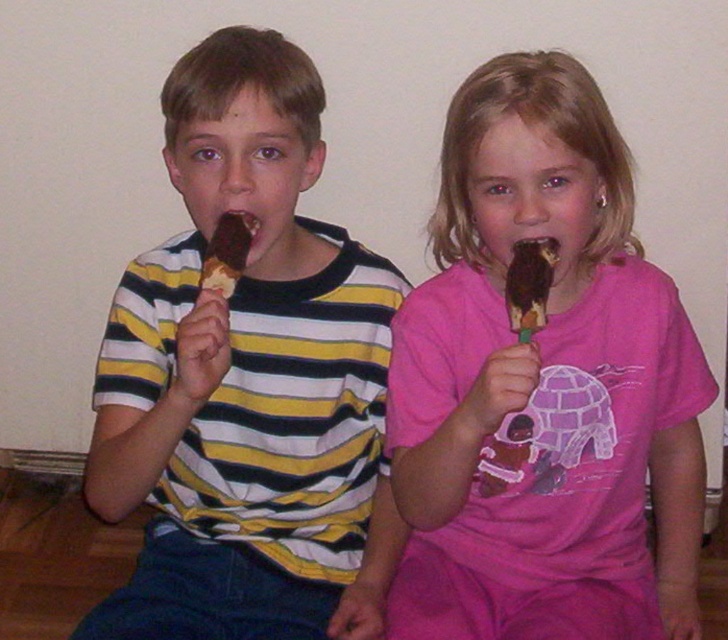
Question: From the image, what is the correct spatial relationship of pink matte ice cream at center in relation to chocolate coated ice cream at upper center?

Choices:
 (A) right
 (B) left

Answer: (A)

Question: Which point is closer to the camera taking this photo?

Choices:
 (A) (711, 401)
 (B) (514, 307)
 (C) (250, 218)

Answer: (B)

Question: Is pink matte ice cream at center wider than chocolate coated ice cream at upper center?

Choices:
 (A) no
 (B) yes

Answer: (B)

Question: Can you confirm if pink matte ice cream at center is positioned above chocolate ice cream at center?

Choices:
 (A) no
 (B) yes

Answer: (A)

Question: Which object is farther from the camera taking this photo?

Choices:
 (A) matte chocolate ice cream bar at center
 (B) chocolate ice cream at center
 (C) pink matte ice cream at center
 (D) chocolate coated ice cream at upper center

Answer: (B)

Question: Which object appears farthest from the camera in this image?

Choices:
 (A) pink matte ice cream at center
 (B) matte chocolate ice cream bar at center
 (C) chocolate ice cream at center

Answer: (C)